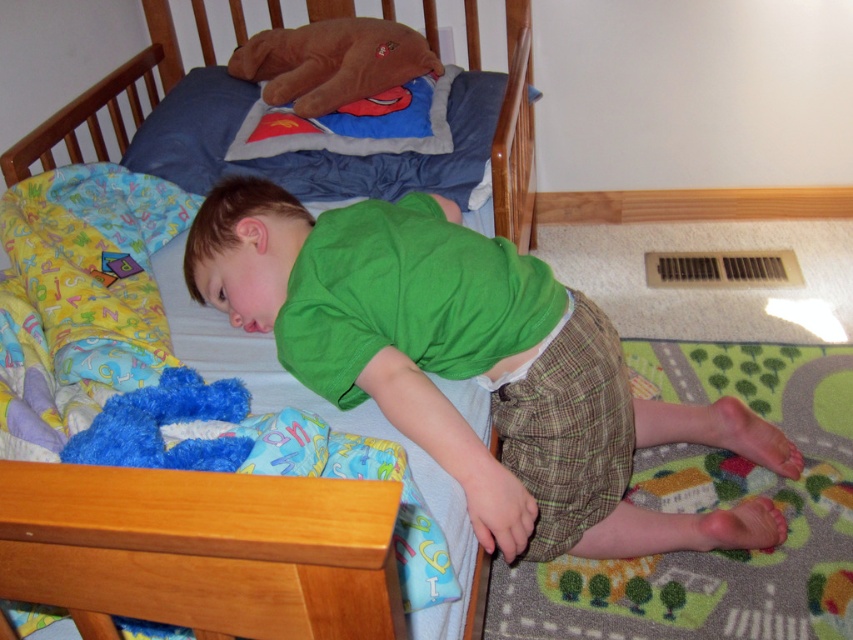
Question: Which is farther from the fuzzy blue stuffed animal at lower left?

Choices:
 (A) wooden crib at upper left
 (B) brown plush bear at upper center
 (C) green cotton shirt at center

Answer: (B)

Question: Is green cotton shirt at center closer to camera compared to fuzzy blue stuffed animal at lower left?

Choices:
 (A) yes
 (B) no

Answer: (B)

Question: Does wooden crib at upper left appear under fuzzy blue stuffed animal at lower left?

Choices:
 (A) yes
 (B) no

Answer: (B)

Question: Which of the following is the farthest from the observer?

Choices:
 (A) fuzzy blue stuffed animal at lower left
 (B) brown plush bear at upper center
 (C) wooden crib at upper left
 (D) green cotton shirt at center

Answer: (B)

Question: Is wooden crib at upper left thinner than fuzzy blue stuffed animal at lower left?

Choices:
 (A) no
 (B) yes

Answer: (A)

Question: Estimate the real-world distances between objects in this image. Which object is farther from the green cotton shirt at center?

Choices:
 (A) fuzzy blue stuffed animal at lower left
 (B) wooden crib at upper left
 (C) brown plush bear at upper center

Answer: (C)